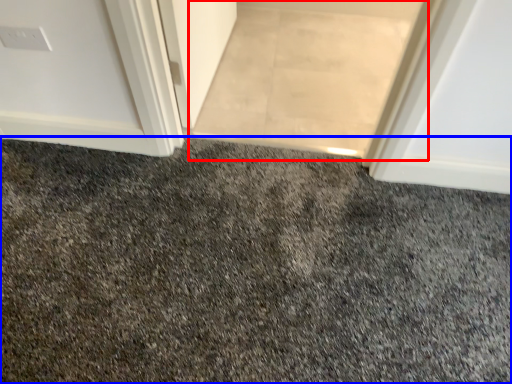
Question: Which object appears closest to the camera in this image, doormat (highlighted by a red box) or granite (highlighted by a blue box)?

Choices:
 (A) doormat
 (B) granite

Answer: (B)